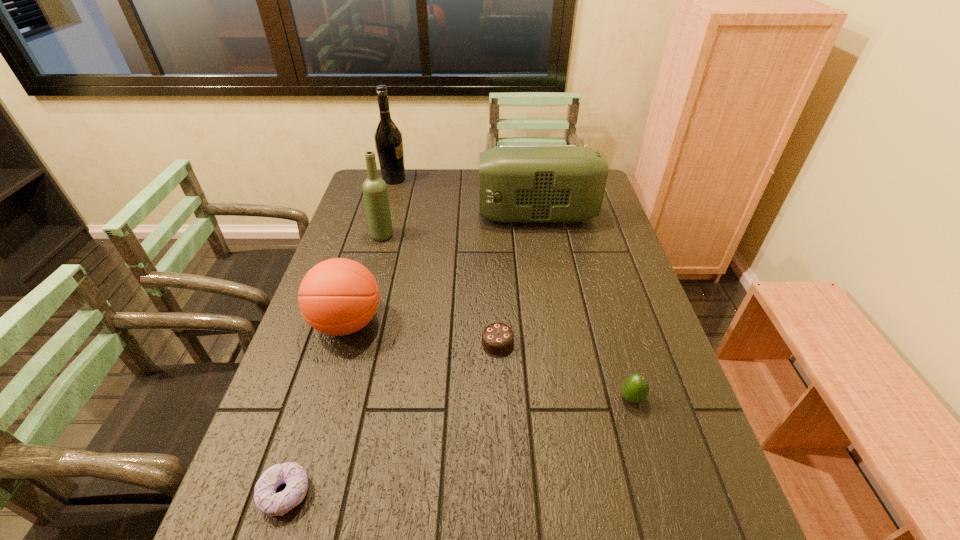
Where is `the nearest object`? the nearest object is located at coordinates (266, 499).

Locate an element on the screen. This screenshot has height=540, width=960. vacant space located on the label of the farther wine bottle is located at coordinates (504, 179).

Where is `vacant space located 0.320m on the front of the nearer wine bottle`? The height and width of the screenshot is (540, 960). vacant space located 0.320m on the front of the nearer wine bottle is located at coordinates (361, 315).

At what (x,y) coordinates should I click in order to perform the action: click on free space located on the front-facing side of the third tallest object. Please return your answer as a coordinate pair (x, y). This screenshot has width=960, height=540. Looking at the image, I should click on (459, 217).

The width and height of the screenshot is (960, 540). What are the coordinates of `vacant space located on the front-facing side of the third tallest object` in the screenshot? It's located at (439, 217).

This screenshot has width=960, height=540. Identify the location of free space located on the front-facing side of the third tallest object. (450, 217).

This screenshot has height=540, width=960. Find the location of `free space located 0.240m on the right of the basketball`. free space located 0.240m on the right of the basketball is located at coordinates (474, 323).

Where is `free space located on the left of the fifth tallest object`? free space located on the left of the fifth tallest object is located at coordinates [x=570, y=398].

Image resolution: width=960 pixels, height=540 pixels. I want to click on vacant space located 0.130m on the left of the chocolate cake, so click(x=430, y=342).

Identify the location of vacant area located on the right of the shortest object. The image size is (960, 540). (410, 494).